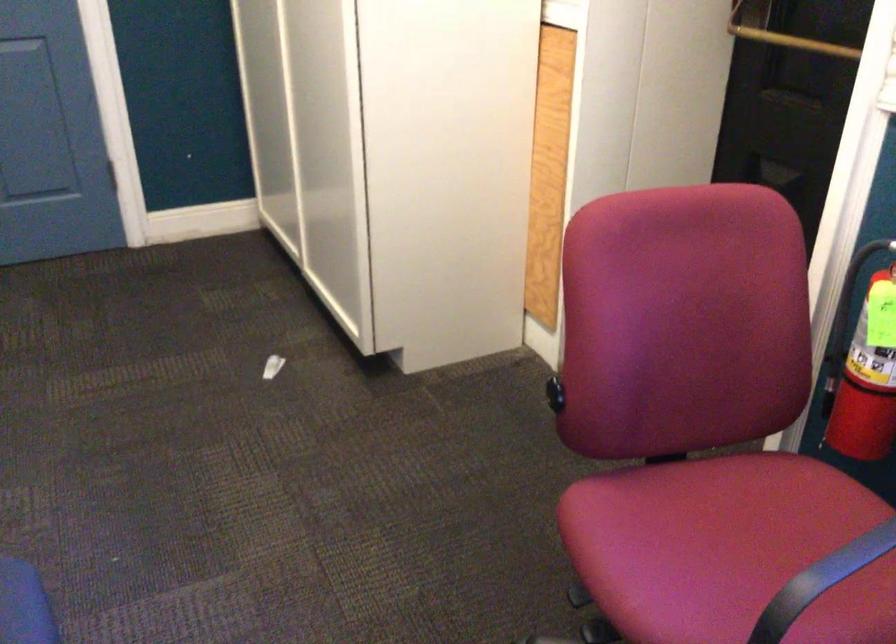
This screenshot has width=896, height=644. Describe the element at coordinates (823, 579) in the screenshot. I see `the black chair armrest` at that location.